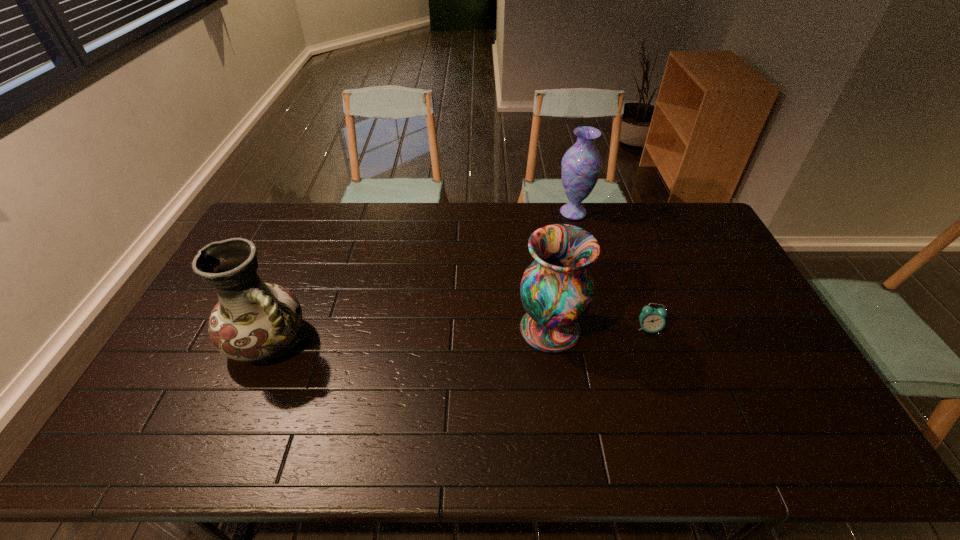
Image resolution: width=960 pixels, height=540 pixels. Find the location of `the farthest vase`. the farthest vase is located at coordinates (581, 165).

The image size is (960, 540). Identify the location of the leftmost vase. (253, 321).

What are the coordinates of `alarm clock` in the screenshot? It's located at (652, 320).

Find the location of a particular element. The width and height of the screenshot is (960, 540). the rightmost object is located at coordinates (652, 320).

Locate an element on the screen. The image size is (960, 540). vacant space located on the front of the farthest vase is located at coordinates (579, 234).

Locate an element on the screen. This screenshot has width=960, height=540. free spot located 0.120m on the right of the leftmost object is located at coordinates (354, 341).

Locate an element on the screen. The width and height of the screenshot is (960, 540). vacant region located 0.090m on the face of the alarm clock is located at coordinates (660, 361).

Image resolution: width=960 pixels, height=540 pixels. I want to click on object situated at the far edge, so click(x=581, y=165).

Locate an element on the screen. Image resolution: width=960 pixels, height=540 pixels. object present at the left edge is located at coordinates (253, 321).

Where is `free region at the far edge of the desktop`? free region at the far edge of the desktop is located at coordinates (614, 229).